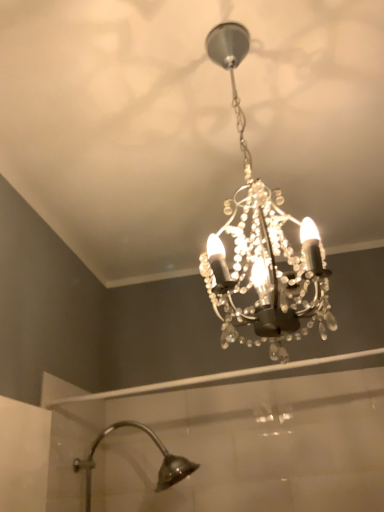
Image resolution: width=384 pixels, height=512 pixels. What do you see at coordinates (262, 243) in the screenshot? I see `clear crystal chandelier at center` at bounding box center [262, 243].

What are the coordinates of `clear crystal chandelier at center` in the screenshot? It's located at (262, 243).

At what (x,y) coordinates should I click in order to perform the action: click on clear crystal chandelier at center. Please return your answer as a coordinate pair (x, y). This screenshot has height=512, width=384. Looking at the image, I should click on click(x=262, y=243).